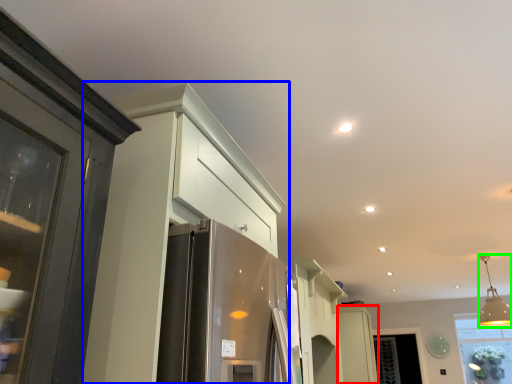
Question: Which object is positioned closest to cabinetry (highlighted by a red box)? Select from cabinetry (highlighted by a blue box) and light fixture (highlighted by a green box).

Choices:
 (A) cabinetry
 (B) light fixture

Answer: (B)